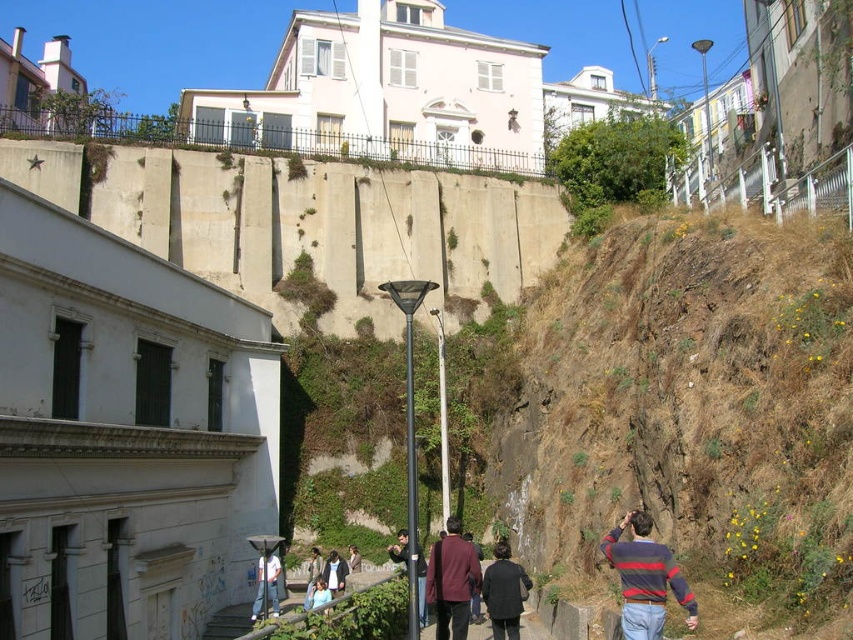
You are a photographer aiming to capture both the maroon fabric coat at center and the light brown leather jacket at center in a single frame. Which one should you focus on first to ensure both are in focus?

You should focus on the maroon fabric coat at center first because it is closer to the camera than the light brown leather jacket at center, ensuring both will be in focus when focused on the closer object.

You are a tour guide leading a group on the pathway. You need to ensure that all participants stay within a 10 feet distance for safety. Are the light blue shirt at center and light brown leather jacket at center within the safe distance?

The light blue shirt at center and light brown leather jacket at center are 15.67 feet apart from each other, which exceeds the 10 feet safety distance requirement. Therefore, they are not within the safe distance.

You are a photographer trying to capture a photo of the maroon fabric coat at center and the white cotton shirt at lower center. Which one should you focus on first to ensure both are in frame?

The maroon fabric coat at center is in front of the white cotton shirt at lower center, so you should focus on the maroon fabric coat at center first to ensure both are in frame.